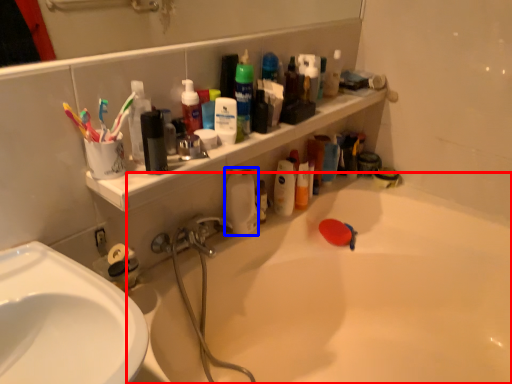
Question: Among these objects, which one is farthest to the camera, bathtub (highlighted by a red box) or cleaning product (highlighted by a blue box)?

Choices:
 (A) bathtub
 (B) cleaning product

Answer: (B)